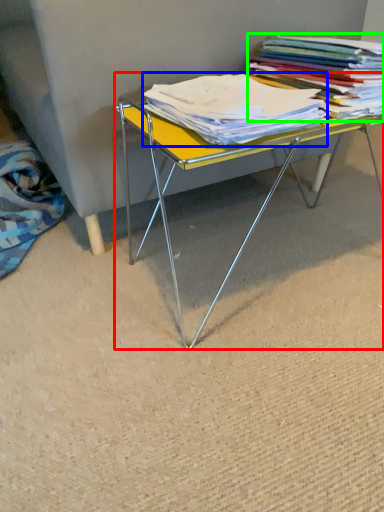
Question: Which is nearer to the table (highlighted by a red box)? magazine (highlighted by a blue box) or book (highlighted by a green box).

Choices:
 (A) magazine
 (B) book

Answer: (A)